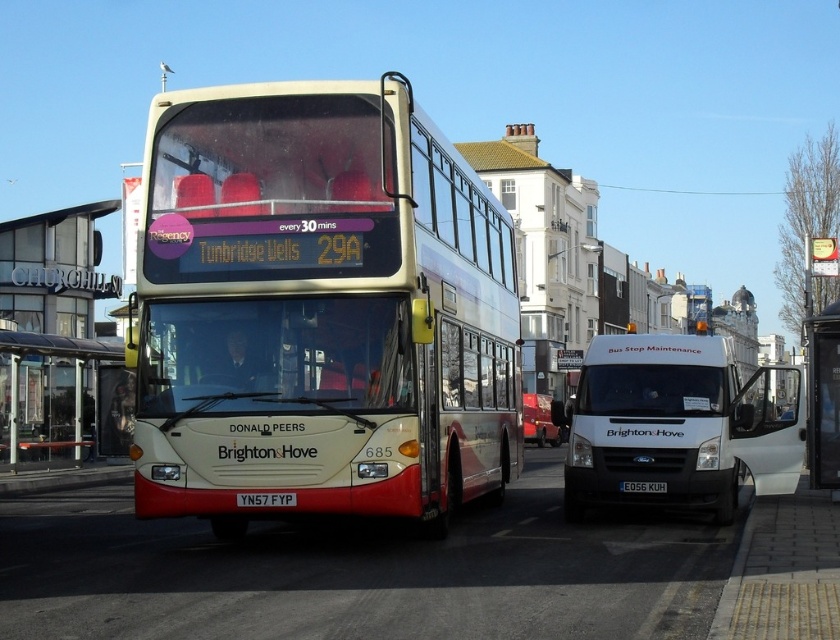
Based on the photo, who is more distant from viewer, (261, 492) or (665, 490)?

Positioned behind is point (665, 490).

Does yellow metallic license plate at center lie in front of black plastic license plate at center?

Yes, yellow metallic license plate at center is in front of black plastic license plate at center.

Describe the element at coordinates (265, 499) in the screenshot. This screenshot has height=640, width=840. I see `yellow metallic license plate at center` at that location.

Find the location of a particular element. This screenshot has height=640, width=840. yellow metallic license plate at center is located at coordinates point(265,499).

Does matte cream double-decker bus at center appear on the right side of white matte van at center?

No, matte cream double-decker bus at center is not to the right of white matte van at center.

Can you confirm if matte cream double-decker bus at center is bigger than white matte van at center?

Correct, matte cream double-decker bus at center is larger in size than white matte van at center.

Measure the distance between point (496, 240) and camera.

Point (496, 240) and camera are 15.01 meters apart.

Identify the location of matte cream double-decker bus at center. This screenshot has width=840, height=640. (319, 308).

Is transparent glass bus stop at left smaller than yellow metallic license plate at center?

Incorrect, transparent glass bus stop at left is not smaller in size than yellow metallic license plate at center.

Describe the element at coordinates (50, 356) in the screenshot. I see `transparent glass bus stop at left` at that location.

Where is `transparent glass bus stop at left`? transparent glass bus stop at left is located at coordinates (50, 356).